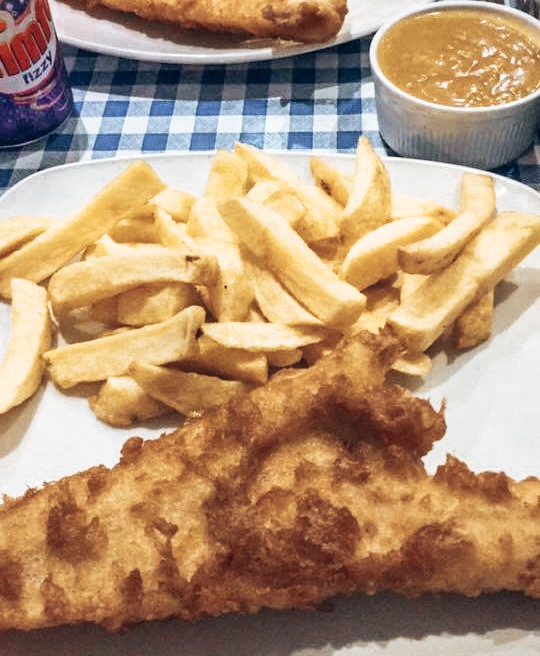
You are a GUI agent. You are given a task and a screenshot of the screen. Output one action in this format:
    pyautogui.click(x=<x>, y=<y>)
    Task: Click on the table
    This screenshot has width=540, height=656.
    Given the screenshot: What is the action you would take?
    pyautogui.click(x=264, y=117)